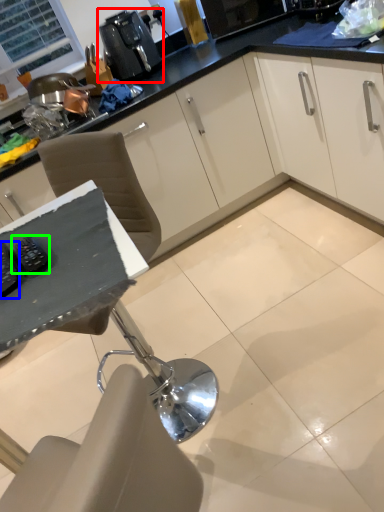
Question: Which object is positioned closest to coffee machine (highlighted by a red box)? Select from appliance (highlighted by a blue box) and appliance (highlighted by a green box).

Choices:
 (A) appliance
 (B) appliance

Answer: (B)